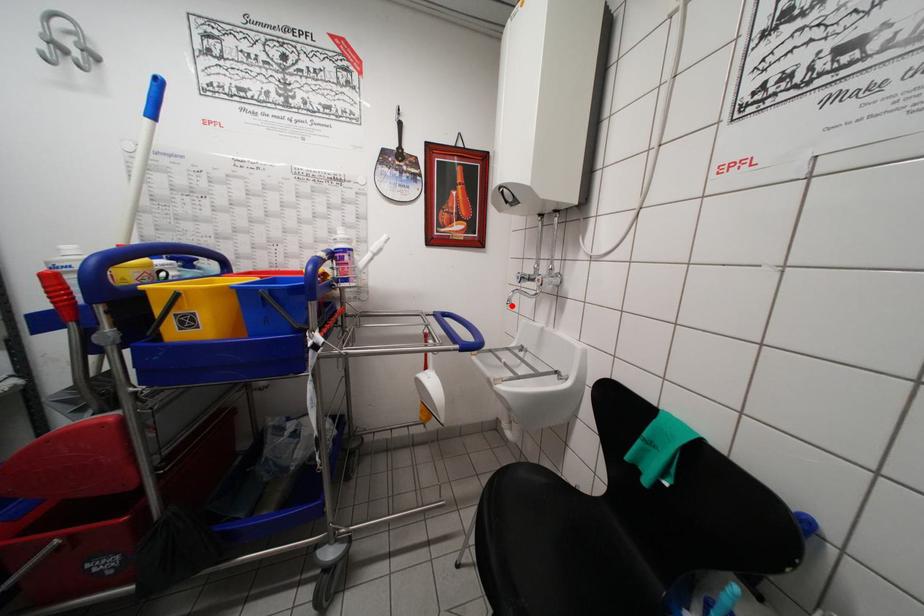
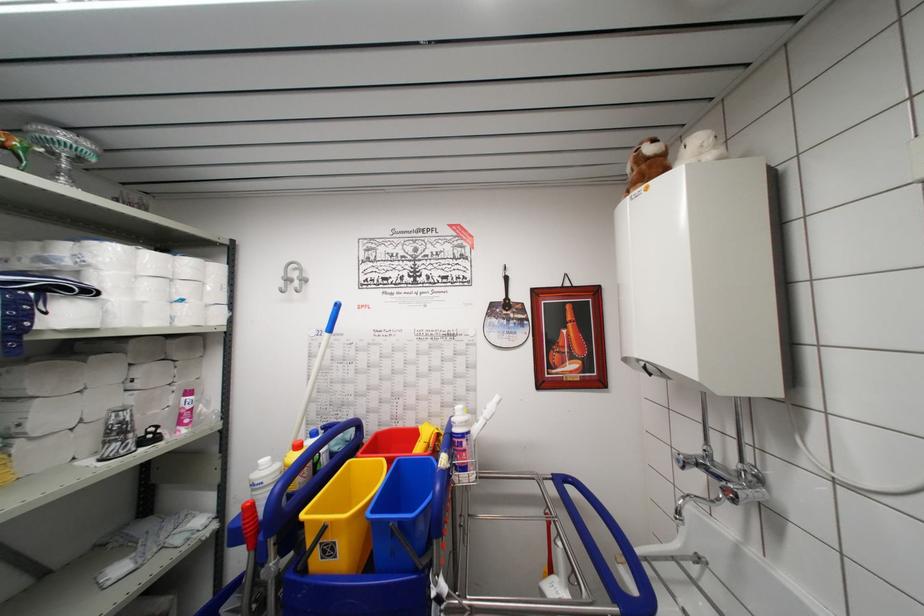
Where in the second image is the point corresponding to the highlighted location from the first image?

(681, 517)